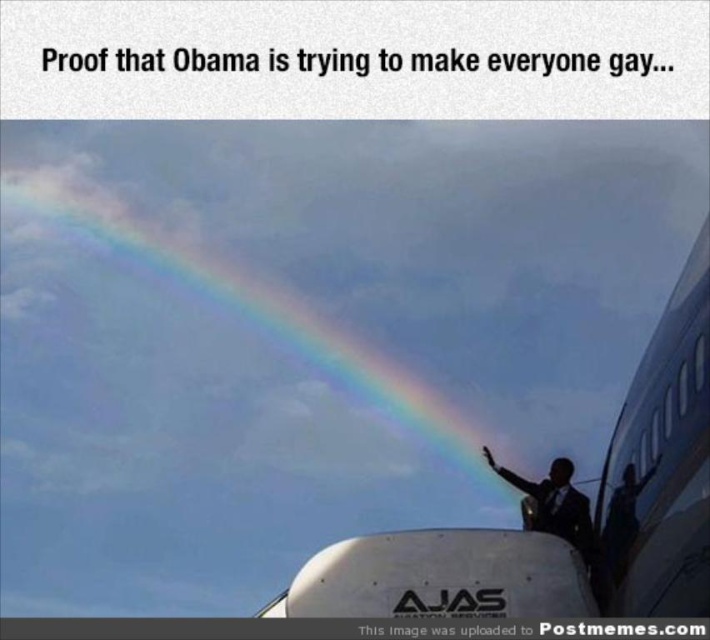
Can you confirm if rainbow at center is wider than white glossy airplane at lower right?

Indeed, rainbow at center has a greater width compared to white glossy airplane at lower right.

Who is positioned more to the right, rainbow at center or white glossy airplane at lower right?

Positioned to the right is white glossy airplane at lower right.

Which is in front, point (212, 305) or point (677, 577)?

Point (677, 577) is more forward.

You are a GUI agent. You are given a task and a screenshot of the screen. Output one action in this format:
    pyautogui.click(x=<x>, y=<y>)
    Task: Click on the rainbow at center
    The height and width of the screenshot is (640, 710).
    Given the screenshot: What is the action you would take?
    pyautogui.click(x=229, y=339)

Looking at this image, is rainbow at center shorter than dark suit at center?

No, rainbow at center is not shorter than dark suit at center.

From the picture: Can you confirm if rainbow at center is wider than dark suit at center?

Indeed, rainbow at center has a greater width compared to dark suit at center.

Between point (488, 328) and point (591, 557), which one is positioned in front?

Point (591, 557) is in front.

You are a GUI agent. You are given a task and a screenshot of the screen. Output one action in this format:
    pyautogui.click(x=<x>, y=<y>)
    Task: Click on the rainbow at center
    
    Given the screenshot: What is the action you would take?
    pyautogui.click(x=229, y=339)

In order to click on white glossy airplane at lower right in this screenshot , I will do `click(557, 531)`.

Is white glossy airplane at lower right smaller than dark suit at center?

Incorrect, white glossy airplane at lower right is not smaller in size than dark suit at center.

Is point (574, 552) in front of point (567, 497)?

That is True.

At what (x,y) coordinates should I click in order to perform the action: click on white glossy airplane at lower right. Please return your answer as a coordinate pair (x, y). This screenshot has width=710, height=640. Looking at the image, I should click on (557, 531).